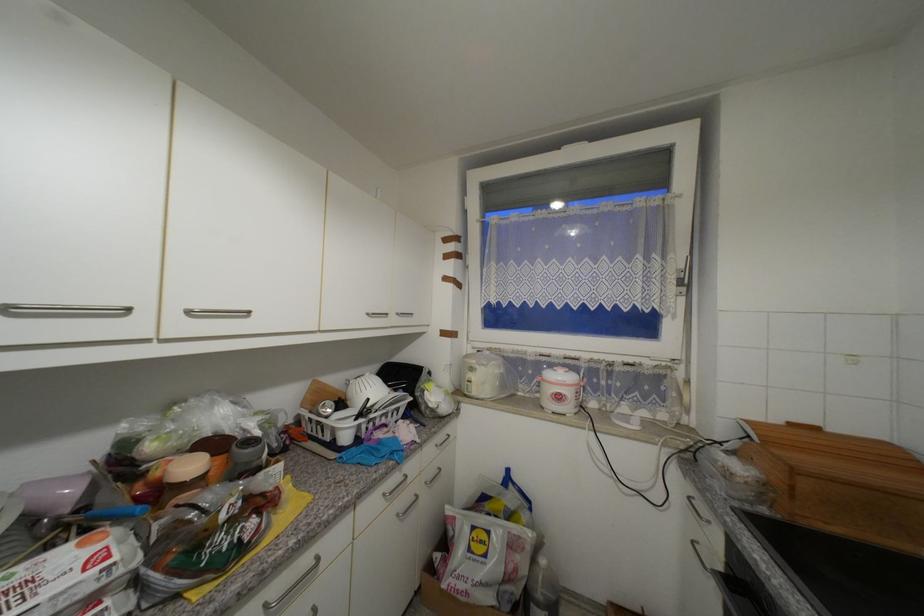
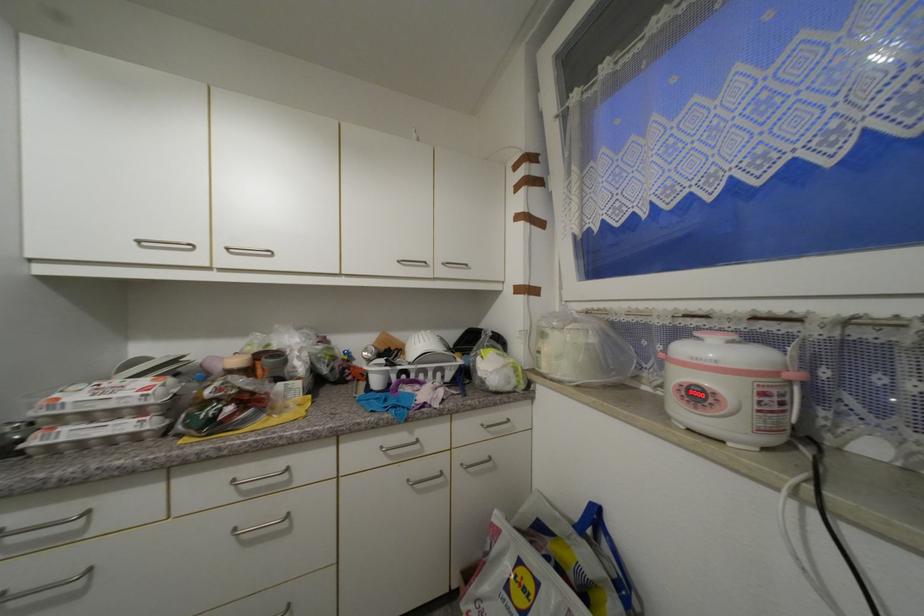
In the second image, find the point that corresponds to the point at 373,315 in the first image.

(405, 262)